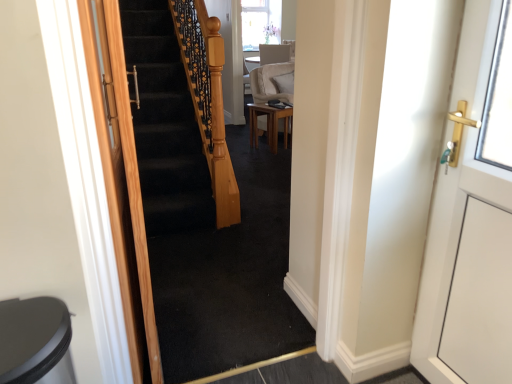
Question: Considering their positions, is wooden door at left, placed as the first door when sorted from left to right, located in front of or behind light brown wooden table at center?

Choices:
 (A) front
 (B) behind

Answer: (A)

Question: Does point (88, 66) appear closer or farther from the camera than point (262, 109)?

Choices:
 (A) closer
 (B) farther

Answer: (A)

Question: Which is farther from the light brown wooden table at center?

Choices:
 (A) wooden door at left, placed as the first door when sorted from left to right
 (B) suede beige armchair at center
 (C) black carpeted stairs at center
 (D) white glossy door at right, the 2th door from the left

Answer: (D)

Question: Which is farther from the suede beige armchair at center?

Choices:
 (A) light brown wooden table at center
 (B) white glossy door at right, the 2th door from the left
 (C) wooden door at left, placed as the first door when sorted from left to right
 (D) black carpeted stairs at center

Answer: (B)